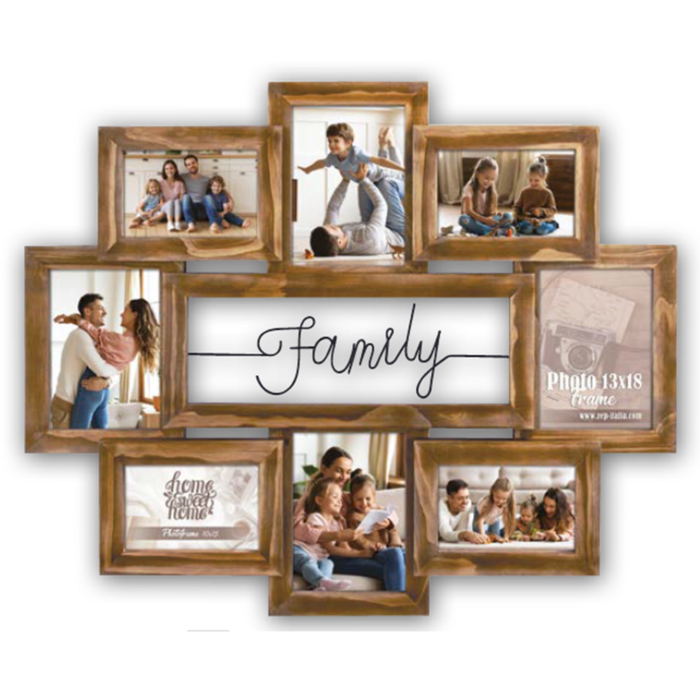
The width and height of the screenshot is (700, 700). I want to click on frames, so click(266, 491), click(288, 469), click(421, 497), click(531, 410), click(638, 439), click(554, 248), click(384, 267), click(234, 248), click(131, 262).